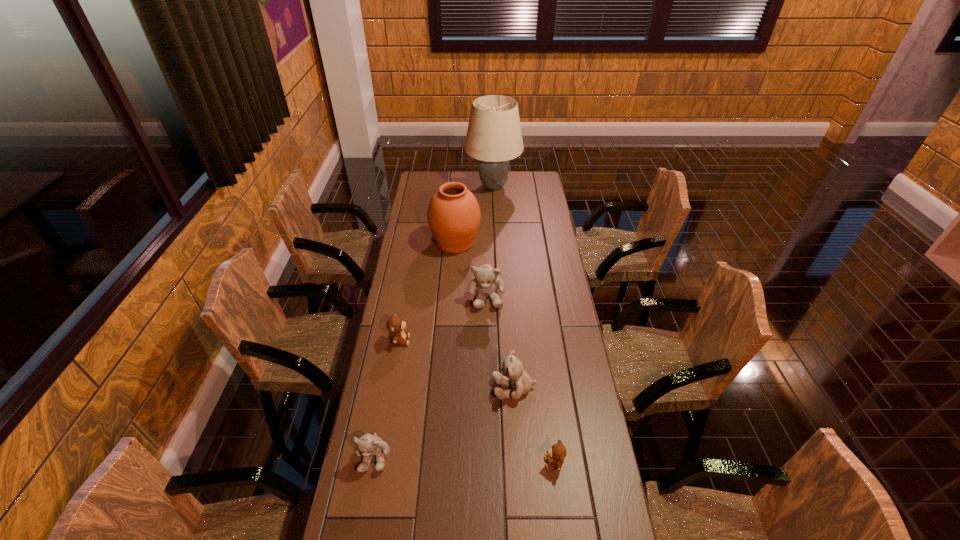
I want to click on blank region between the lampshade and the farthest teddy bear, so click(490, 241).

The width and height of the screenshot is (960, 540). I want to click on object that stands as the sixth closest to the farthest teddy bear, so click(494, 136).

Point out which object is positioned as the third nearest to the sixth shortest object. Please provide its 2D coordinates. Your answer should be formatted as a tuple, i.e. [(x, y)], where the tuple contains the x and y coordinates of a point satisfying the conditions above.

[(395, 325)]

Select which teddy bear appears as the fourth closest to the nearest gray teddy bear. Please provide its 2D coordinates. Your answer should be formatted as a tuple, i.e. [(x, y)], where the tuple contains the x and y coordinates of a point satisfying the conditions above.

[(485, 282)]

Locate which teddy bear is the fifth closest to the sixth nearest object. Please provide its 2D coordinates. Your answer should be formatted as a tuple, i.e. [(x, y)], where the tuple contains the x and y coordinates of a point satisfying the conditions above.

[(556, 454)]

Identify which gray teddy bear is located as the nearest to the farther brown teddy bear. Please provide its 2D coordinates. Your answer should be formatted as a tuple, i.e. [(x, y)], where the tuple contains the x and y coordinates of a point satisfying the conditions above.

[(485, 282)]

Where is `gray teddy bear identified as the second closest to the fourth nearest object`? gray teddy bear identified as the second closest to the fourth nearest object is located at coordinates (515, 376).

In order to click on vacant position in the image that satisfies the following two spatial constraints: 1. on the face of the fourth shortest teddy bear; 2. on the face of the nearest gray teddy bear in this screenshot , I will do `click(518, 456)`.

This screenshot has height=540, width=960. I want to click on free space in the image that satisfies the following two spatial constraints: 1. on the face of the second farthest gray teddy bear; 2. on the face of the nearest gray teddy bear, so click(518, 456).